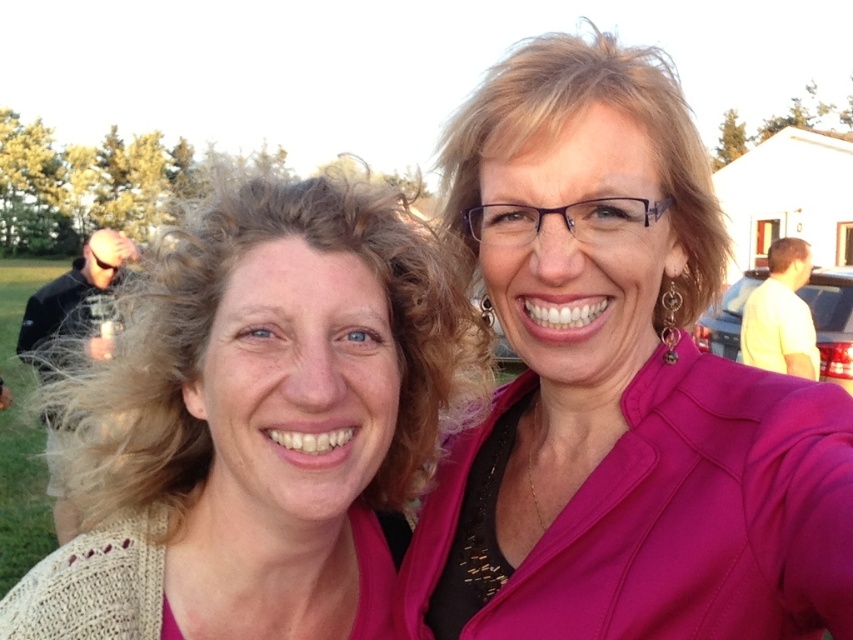
Question: Where is pink matte blazer at upper right located in relation to knitted beige sweater at left in the image?

Choices:
 (A) above
 (B) below

Answer: (A)

Question: Among these points, which one is nearest to the camera?

Choices:
 (A) (606, 220)
 (B) (218, 483)

Answer: (A)

Question: Is pink matte blazer at upper right to the right of knitted beige sweater at left from the viewer's perspective?

Choices:
 (A) yes
 (B) no

Answer: (A)

Question: Does pink matte blazer at upper right have a lesser width compared to knitted beige sweater at left?

Choices:
 (A) no
 (B) yes

Answer: (B)

Question: Which point is farther to the camera?

Choices:
 (A) (711, 477)
 (B) (248, 465)

Answer: (A)